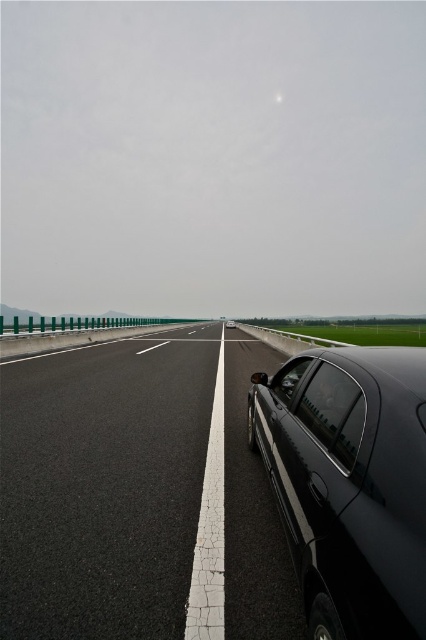
You are driving a car and see two points on the highway. The first point is at coordinates point (328, 369) and the second is at point (290, 385). Which point is closer to your current position if you are driving towards the distant end of the highway?

Point (328, 369) is in front of point (290, 385), so if you are driving towards the distant end of the highway, the point (328, 369) is closer to your current position.

You are a passenger in a car driving on the highway. You look out the window and see the transparent glass window at lower right and the transparent glass window at center. Which window is shorter in height?

The transparent glass window at lower right has a lesser height compared to the transparent glass window at center, so it is shorter.